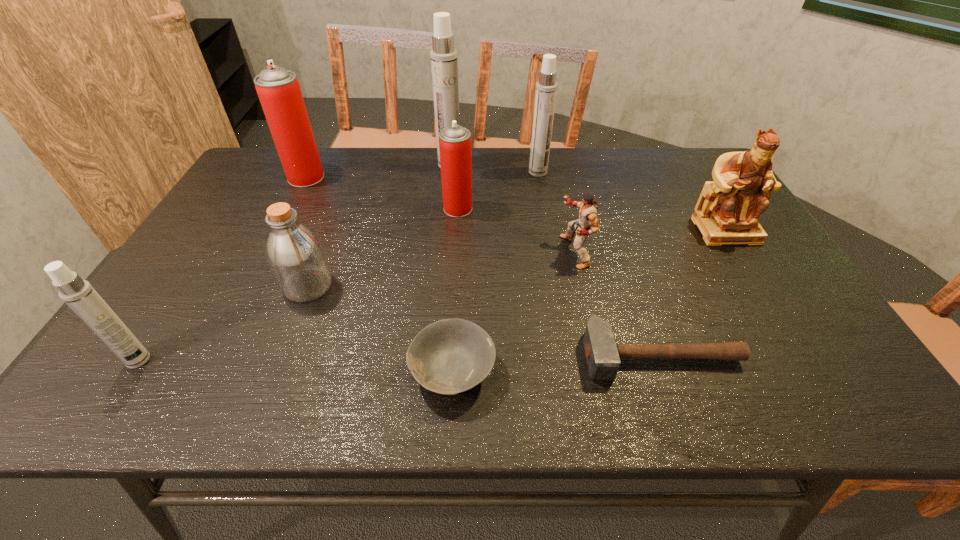
Where is `the second white aerosol can from right to left`? The width and height of the screenshot is (960, 540). the second white aerosol can from right to left is located at coordinates (444, 61).

At what (x,y) coordinates should I click in order to perform the action: click on the tallest object. Please return your answer as a coordinate pair (x, y). Looking at the image, I should click on (444, 61).

The height and width of the screenshot is (540, 960). In order to click on the bigger red aerosol can in this screenshot , I will do `click(278, 89)`.

At what (x,y) coordinates should I click in order to perform the action: click on the left red aerosol can. Please return your answer as a coordinate pair (x, y). The width and height of the screenshot is (960, 540). Looking at the image, I should click on (278, 89).

In order to click on the second biggest white aerosol can in this screenshot , I will do `click(546, 88)`.

Where is `the rightmost white aerosol can`? Image resolution: width=960 pixels, height=540 pixels. the rightmost white aerosol can is located at coordinates (546, 88).

Find the location of a particular element. Image resolution: width=960 pixels, height=540 pixels. the rightmost object is located at coordinates (726, 213).

Where is `the right red aerosol can`? the right red aerosol can is located at coordinates (455, 148).

Locate an element on the screen. Image resolution: width=960 pixels, height=540 pixels. the nearer red aerosol can is located at coordinates (455, 148).

Find the location of a particular element. The image size is (960, 540). the smallest white aerosol can is located at coordinates (79, 295).